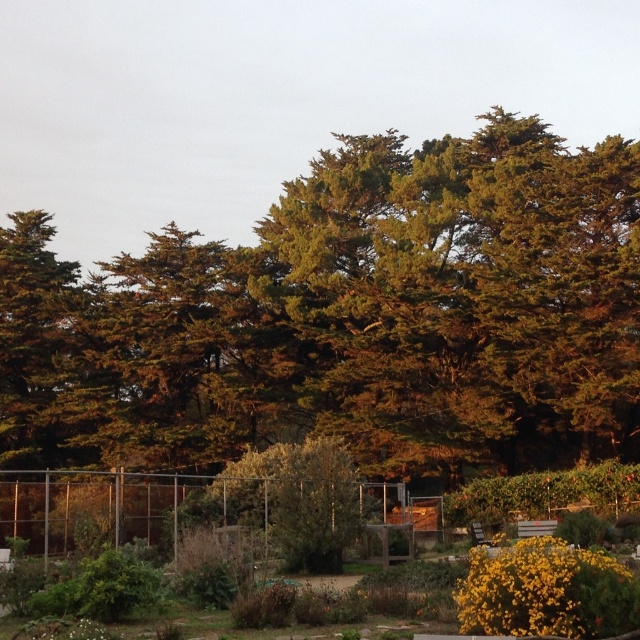
Can you confirm if green textured tree at center is shorter than green leafy bush at center?

In fact, green textured tree at center may be taller than green leafy bush at center.

Is green textured tree at center smaller than green leafy bush at center?

No.

Where is `green textured tree at center`? Image resolution: width=640 pixels, height=640 pixels. green textured tree at center is located at coordinates (349, 317).

Who is taller, green leafy bush at center or wooden bench at lower right?

green leafy bush at center

Can you confirm if green leafy bush at center is smaller than wooden bench at lower right?

No.

The height and width of the screenshot is (640, 640). I want to click on green leafy bush at center, so click(547, 592).

Is green textured tree at center thinner than wooden bench at lower right?

No.

Is green textured tree at center smaller than wooden bench at lower right?

Actually, green textured tree at center might be larger than wooden bench at lower right.

Find the location of `green textured tree at center`. green textured tree at center is located at coordinates (349, 317).